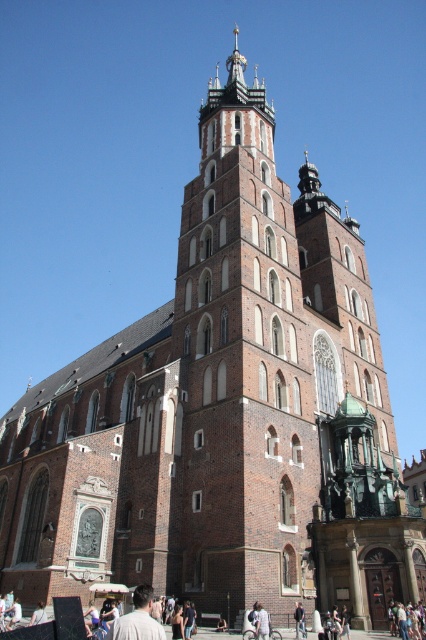
You are standing in front of the historic church and notice a person wearing a light beige shirt at lower center and a light brown leather jacket at center. Which clothing item is visible above the other?

The light beige shirt at lower center is positioned over the light brown leather jacket at center, so the light beige shirt at lower center is visible above the light brown leather jacket at center.